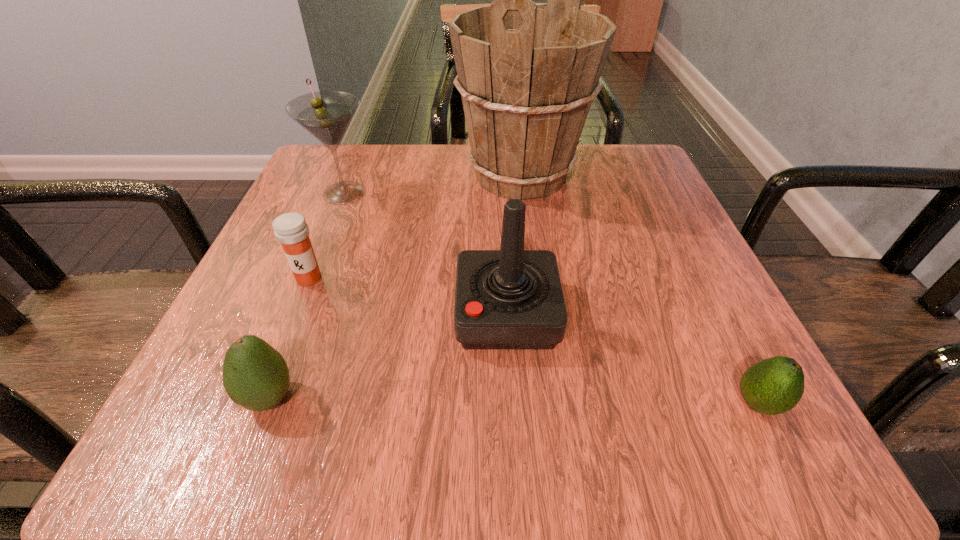
I want to click on empty location between the taller avocado and the tallest object, so click(x=395, y=286).

Find the location of a particular element. Image resolution: width=960 pixels, height=540 pixels. the closest object to the shortest object is located at coordinates (511, 298).

You are a GUI agent. You are given a task and a screenshot of the screen. Output one action in this format:
    pyautogui.click(x=<x>, y=<y>)
    Task: Click on the object that ranks as the second closest to the shorter avocado
    
    Given the screenshot: What is the action you would take?
    pyautogui.click(x=527, y=73)

Where is `vacant space that satisfies the following two spatial constraints: 1. on the front side of the left avocado; 2. on the right side of the shorter avocado`? The image size is (960, 540). vacant space that satisfies the following two spatial constraints: 1. on the front side of the left avocado; 2. on the right side of the shorter avocado is located at coordinates (267, 403).

Where is `vacant area in the image that satisfies the following two spatial constraints: 1. on the front-facing side of the joystick; 2. on the back side of the shortest object`? The height and width of the screenshot is (540, 960). vacant area in the image that satisfies the following two spatial constraints: 1. on the front-facing side of the joystick; 2. on the back side of the shortest object is located at coordinates (512, 403).

Image resolution: width=960 pixels, height=540 pixels. I want to click on free space that satisfies the following two spatial constraints: 1. on the front side of the rightmost object; 2. on the right side of the taller avocado, so click(267, 403).